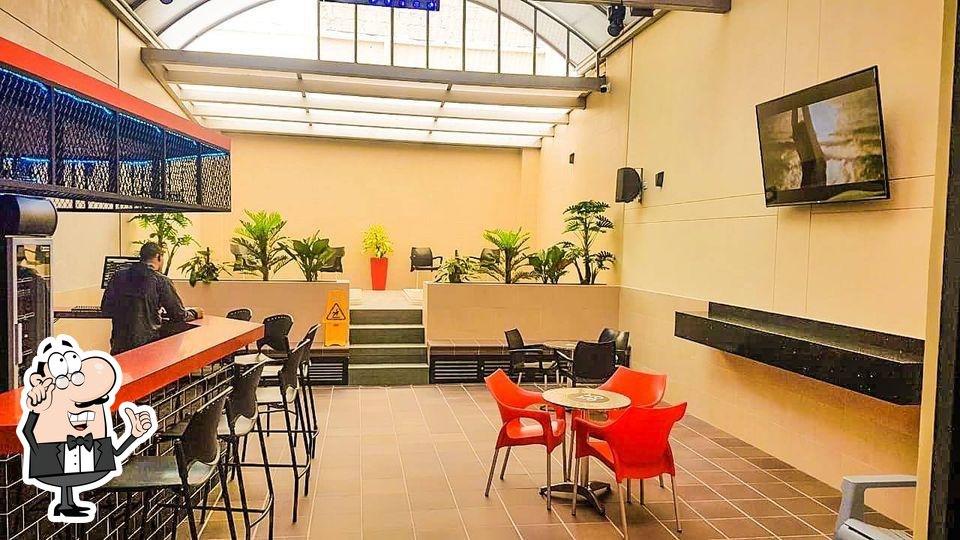
You are a GUI agent. You are given a task and a screenshot of the screen. Output one action in this format:
    pyautogui.click(x=<x>, y=<y>)
    Task: Click on the dark gray stairsteps
    The width and height of the screenshot is (960, 540).
    Given the screenshot: What is the action you would take?
    pyautogui.click(x=393, y=370), pyautogui.click(x=393, y=356), pyautogui.click(x=394, y=336), pyautogui.click(x=396, y=319)